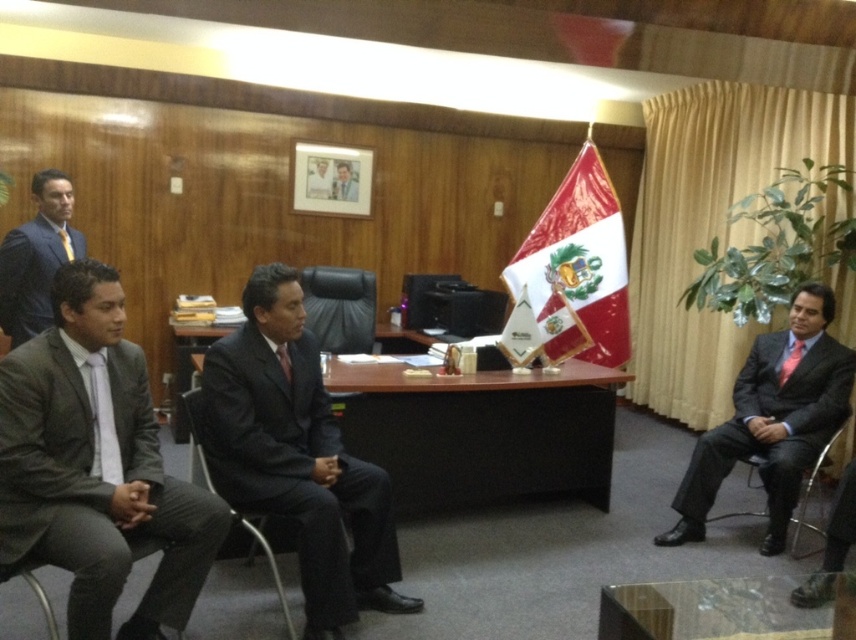
You are a guest entering the room and need to sit down. You see a matte black suit at right and a black fabric chair at right. Which one is the correct object to sit on?

The black fabric chair at right is the correct object to sit on because it is shorter than the matte black suit at right.

You are standing in the conference room and need to locate the matte black suit at right. Where would you find it?

The matte black suit at right is located at the coordinates point (771, 419) in the conference room.